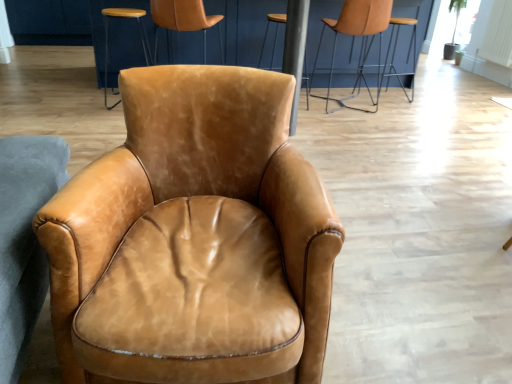
Question: Which direction should I rotate to look at leather chair at upper center, which is the 1th chair in left-to-right order?

Choices:
 (A) right
 (B) left

Answer: (B)

Question: Considering the relative positions of saddle brown leather armchair at center, the 2th chair in the left-to-right sequence, and leather armchair at upper right, arranged as the fourth chair when viewed from the front, in the image provided, is saddle brown leather armchair at center, the 2th chair in the left-to-right sequence, to the right of leather armchair at upper right, arranged as the fourth chair when viewed from the front, from the viewer's perspective?

Choices:
 (A) yes
 (B) no

Answer: (B)

Question: Does saddle brown leather armchair at center, the fourth chair viewed from the back, have a smaller size compared to leather armchair at upper right, positioned as the first chair in right-to-left order?

Choices:
 (A) no
 (B) yes

Answer: (A)

Question: From the image's perspective, is saddle brown leather armchair at center, which is the 3th chair in right-to-left order, over leather armchair at upper right, positioned as the first chair in right-to-left order?

Choices:
 (A) no
 (B) yes

Answer: (A)

Question: Is saddle brown leather armchair at center, the first chair positioned from the front, in front of leather armchair at upper right, positioned as the first chair in right-to-left order?

Choices:
 (A) no
 (B) yes

Answer: (B)

Question: From the image's perspective, would you say saddle brown leather armchair at center, the 2th chair in the left-to-right sequence, is shown under leather armchair at upper right, the first chair viewed from the back?

Choices:
 (A) no
 (B) yes

Answer: (B)

Question: Is saddle brown leather armchair at center, the fourth chair viewed from the back, to the left of leather armchair at upper right, arranged as the fourth chair when viewed from the front, from the viewer's perspective?

Choices:
 (A) no
 (B) yes

Answer: (B)

Question: Is leather tan chair at upper center, which appears as the 2th chair when viewed from the right, looking in the opposite direction of brown leather bar stool at center?

Choices:
 (A) no
 (B) yes

Answer: (A)

Question: Is leather tan chair at upper center, which is the second chair from back to front, to the left of brown leather bar stool at center from the viewer's perspective?

Choices:
 (A) yes
 (B) no

Answer: (B)

Question: Is leather tan chair at upper center, which is the second chair from back to front, bigger than brown leather bar stool at center?

Choices:
 (A) no
 (B) yes

Answer: (B)

Question: Is leather tan chair at upper center, the 3th chair in the left-to-right sequence, further to camera compared to brown leather bar stool at center?

Choices:
 (A) yes
 (B) no

Answer: (B)

Question: Considering the relative positions of leather tan chair at upper center, which is the second chair from back to front, and brown leather bar stool at center in the image provided, is leather tan chair at upper center, which is the second chair from back to front, to the right of brown leather bar stool at center from the viewer's perspective?

Choices:
 (A) no
 (B) yes

Answer: (B)

Question: Is brown leather bar stool at center surrounded by leather tan chair at upper center, which appears as the 2th chair when viewed from the right?

Choices:
 (A) no
 (B) yes

Answer: (A)

Question: Is leather tan chair at upper center, which is the second chair from back to front, thinner than saddle brown leather armchair at center, the 2th chair in the left-to-right sequence?

Choices:
 (A) yes
 (B) no

Answer: (A)